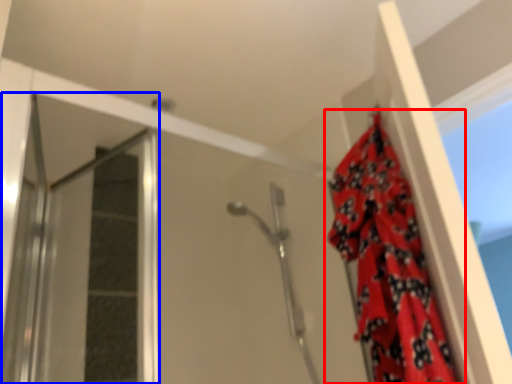
Question: Which of the following is the farthest to the observer, curtain (highlighted by a red box) or screen door (highlighted by a blue box)?

Choices:
 (A) curtain
 (B) screen door

Answer: (B)